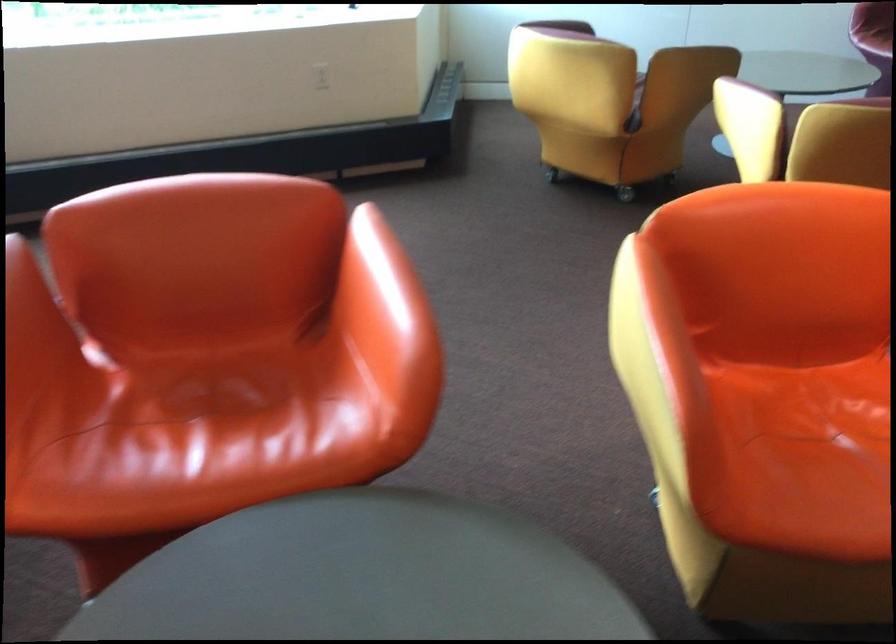
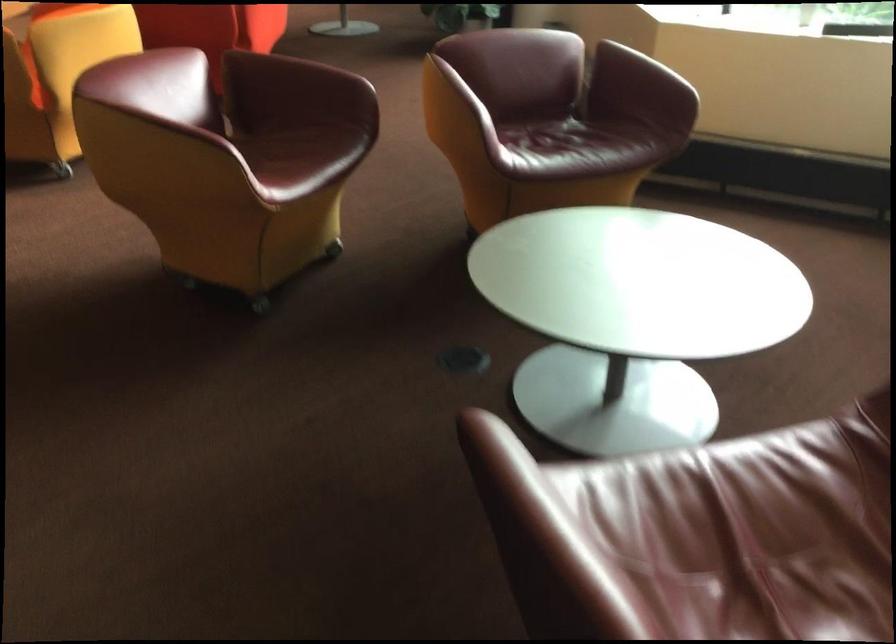
Where in the second image is the point corresponding to the point at 730,97 from the first image?

(291, 75)